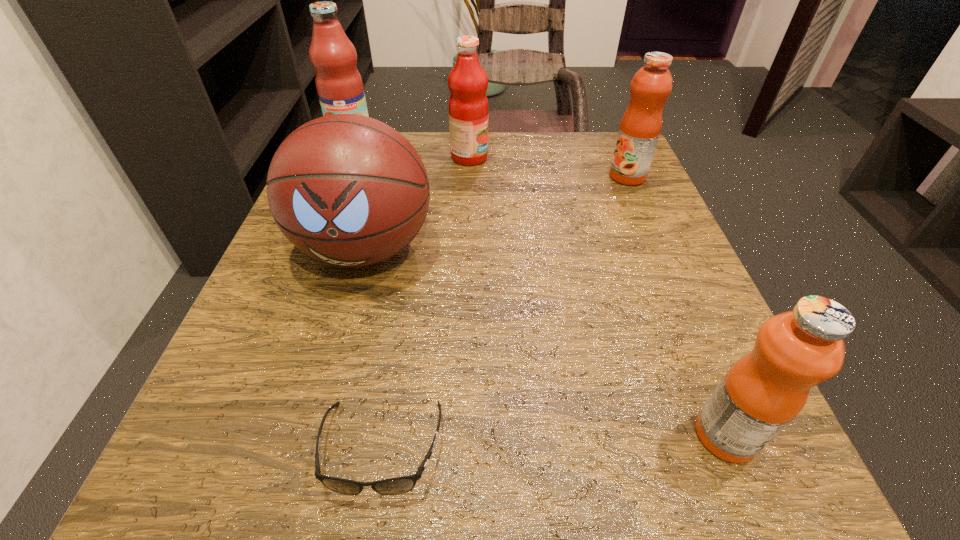
This screenshot has height=540, width=960. I want to click on sunglasses positioned at the near edge, so click(393, 486).

This screenshot has width=960, height=540. What are the coordinates of `fruit juice located in the left edge section of the desktop` in the screenshot? It's located at (339, 85).

Image resolution: width=960 pixels, height=540 pixels. Identify the location of basketball at the left edge. (348, 190).

Where is `object positioned at the far left corner`? The height and width of the screenshot is (540, 960). object positioned at the far left corner is located at coordinates (339, 85).

The width and height of the screenshot is (960, 540). I want to click on object present at the far right corner, so click(640, 127).

In order to click on object located at the near right corner in this screenshot , I will do `click(763, 391)`.

Where is `free spot at the far edge of the desktop`? The width and height of the screenshot is (960, 540). free spot at the far edge of the desktop is located at coordinates (443, 132).

In the image, there is a desktop. Identify the location of vacant space at the near edge. (603, 482).

What are the coordinates of `vacant area at the left edge of the desktop` in the screenshot? It's located at (262, 339).

This screenshot has width=960, height=540. I want to click on free point at the right edge, so click(x=649, y=199).